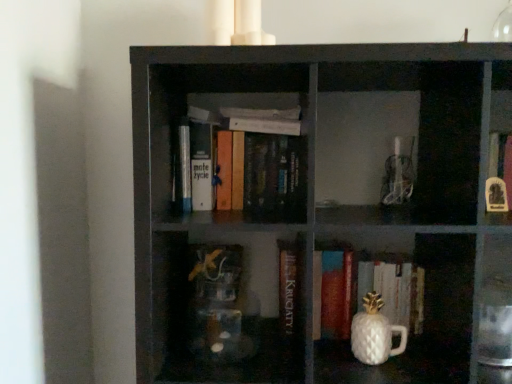
Question: From the image's perspective, is black matte bookshelf at center over transparent glass vase at upper right?

Choices:
 (A) no
 (B) yes

Answer: (A)

Question: Considering the relative sizes of black matte bookshelf at center and transparent glass vase at upper right in the image provided, is black matte bookshelf at center taller than transparent glass vase at upper right?

Choices:
 (A) no
 (B) yes

Answer: (B)

Question: Is the depth of black matte bookshelf at center greater than that of transparent glass vase at upper right?

Choices:
 (A) no
 (B) yes

Answer: (A)

Question: Does black matte bookshelf at center come in front of transparent glass vase at upper right?

Choices:
 (A) no
 (B) yes

Answer: (B)

Question: From a real-world perspective, is black matte bookshelf at center under transparent glass vase at upper right?

Choices:
 (A) yes
 (B) no

Answer: (A)

Question: Is point (282, 251) positioned closer to the camera than point (266, 178)?

Choices:
 (A) closer
 (B) farther

Answer: (B)

Question: Looking at their shapes, would you say hardcover book at center, placed as the second book when sorted from right to left, is wider or thinner than hardcover books at center, which appears as the 1th book when viewed from the left?

Choices:
 (A) thin
 (B) wide

Answer: (A)

Question: Considering their positions, is hardcover book at center, placed as the second book when sorted from right to left, located in front of or behind hardcover books at center, which appears as the 1th book when viewed from the left?

Choices:
 (A) behind
 (B) front

Answer: (A)

Question: From the image's perspective, is hardcover book at center, the 2th book when ordered from left to right, located above or below hardcover books at center, which appears as the 1th book when viewed from the left?

Choices:
 (A) below
 (B) above

Answer: (A)

Question: Is white glossy pineapple-shaped object at lower center, acting as the 3th book starting from the left, inside or outside of black matte bookshelf at center?

Choices:
 (A) outside
 (B) inside

Answer: (B)

Question: From the image's perspective, is white glossy pineapple-shaped object at lower center, the 1th book viewed from the right, positioned above or below black matte bookshelf at center?

Choices:
 (A) above
 (B) below

Answer: (B)

Question: Considering the positions of point (403, 264) and point (233, 76), is point (403, 264) closer or farther from the camera than point (233, 76)?

Choices:
 (A) farther
 (B) closer

Answer: (B)

Question: Relative to black matte bookshelf at center, is white glossy pineapple-shaped object at lower center, the 1th book viewed from the right, in front or behind?

Choices:
 (A) front
 (B) behind

Answer: (B)

Question: Considering their positions, is white glossy pineapple-shaped object at lower center, the 1th book viewed from the right, located in front of or behind transparent glass vase at upper right?

Choices:
 (A) front
 (B) behind

Answer: (B)

Question: In terms of width, does white glossy pineapple-shaped object at lower center, acting as the 3th book starting from the left, look wider or thinner when compared to transparent glass vase at upper right?

Choices:
 (A) wide
 (B) thin

Answer: (B)